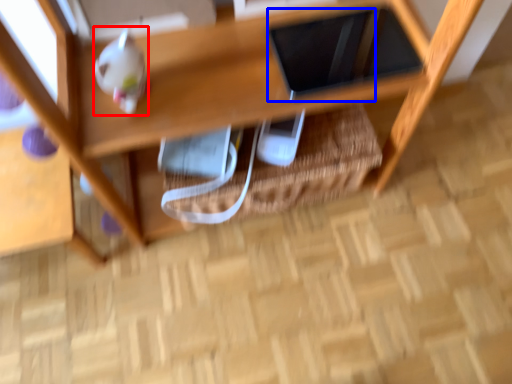
Question: Which of the following is the closest to the observer, toy (highlighted by a red box) or tablet computer (highlighted by a blue box)?

Choices:
 (A) toy
 (B) tablet computer

Answer: (A)